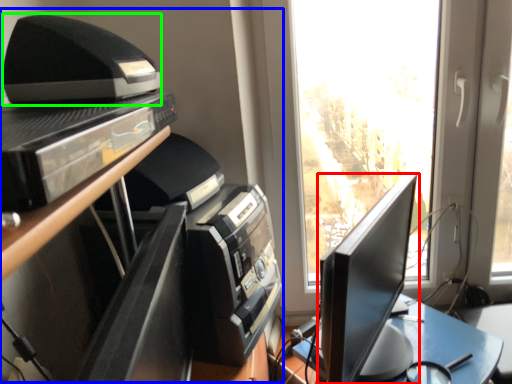
Question: Considering the real-world distances, which object is closest to computer monitor (highlighted by a red box)? entertainment center (highlighted by a blue box) or printer (highlighted by a green box).

Choices:
 (A) entertainment center
 (B) printer

Answer: (A)